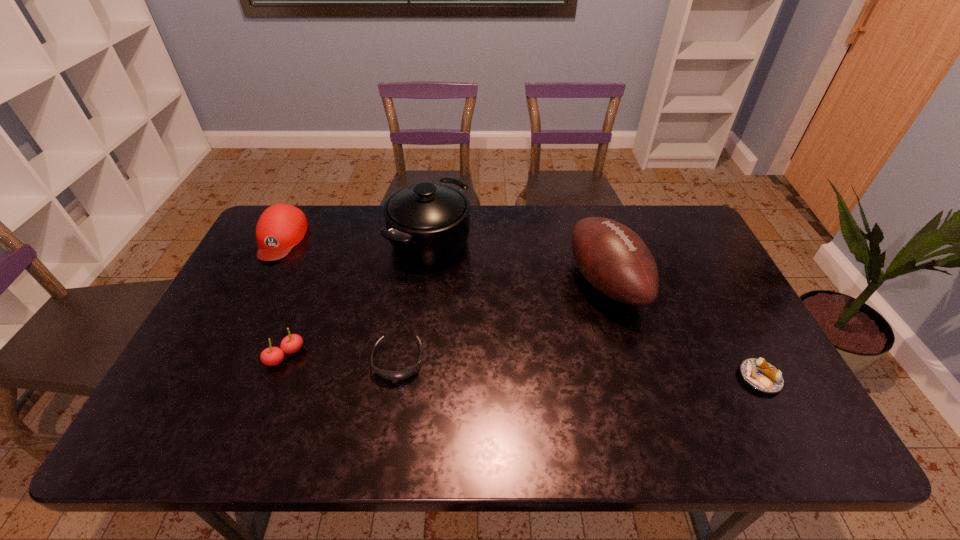
Identify the location of vacant space located on the right of the second object from right to left. Image resolution: width=960 pixels, height=540 pixels. (706, 282).

In order to click on free space located on the front-facing side of the fourth shortest object in this screenshot , I will do [254, 291].

Find the location of `vacant region located 0.140m on the front of the fourth tallest object`. vacant region located 0.140m on the front of the fourth tallest object is located at coordinates (259, 423).

You are a GUI agent. You are given a task and a screenshot of the screen. Output one action in this format:
    pyautogui.click(x=<x>, y=<y>)
    Task: Click on the free region located on the lenses of the second shortest object
    The width and height of the screenshot is (960, 540).
    Given the screenshot: What is the action you would take?
    pyautogui.click(x=392, y=402)

Find the location of `vacant region located 0.380m on the back of the shortest object`. vacant region located 0.380m on the back of the shortest object is located at coordinates (697, 260).

Identify the location of saucepan at the far edge. (428, 223).

Locate an element on the screen. The width and height of the screenshot is (960, 540). football (American) located at the far edge is located at coordinates (614, 259).

The image size is (960, 540). Find the location of `baseball cap at the far edge`. baseball cap at the far edge is located at coordinates (281, 227).

This screenshot has height=540, width=960. What are the coordinates of `object that is at the left edge` in the screenshot? It's located at (281, 227).

What are the coordinates of `object that is at the right edge` in the screenshot? It's located at (763, 376).